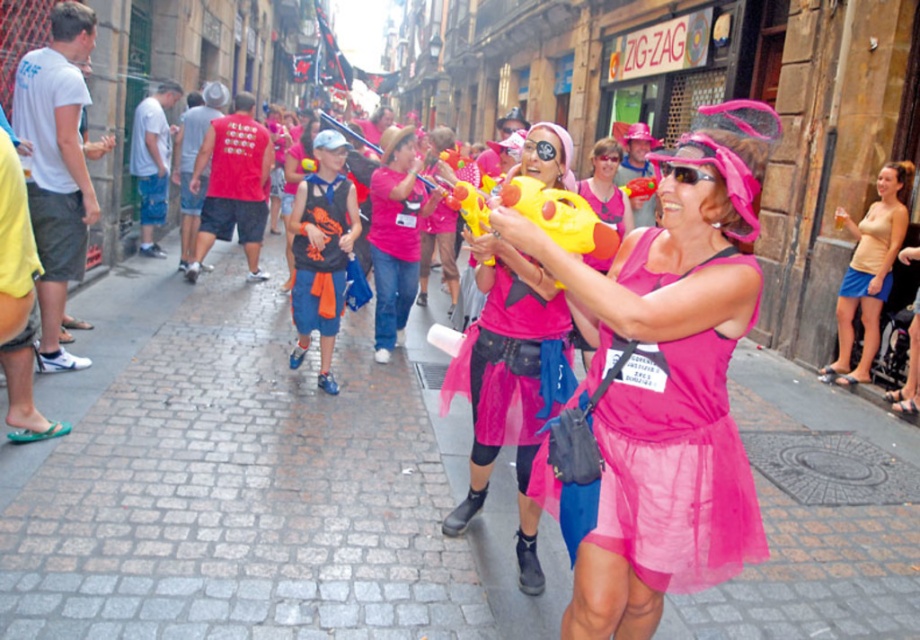
Question: Which object appears closest to the camera in this image?

Choices:
 (A) beige cotton tank top at right
 (B) pink fabric toy gun at center
 (C) matte pink tulle dress at center

Answer: (C)

Question: Based on their relative distances, which object is farther from the matte pink tulle skirt at center?

Choices:
 (A) beige cotton tank top at right
 (B) matte pink tulle dress at center

Answer: (A)

Question: Does matte pink tulle skirt at center have a greater width compared to pink fabric toy gun at center?

Choices:
 (A) no
 (B) yes

Answer: (A)

Question: Among these points, which one is farthest from the camera?

Choices:
 (A) (716, 384)
 (B) (726, 140)
 (C) (415, 188)

Answer: (C)

Question: Can you confirm if matte pink tulle dress at center is bigger than matte pink tulle skirt at center?

Choices:
 (A) no
 (B) yes

Answer: (A)

Question: Is matte pink tulle dress at center thinner than pink fabric toy gun at center?

Choices:
 (A) yes
 (B) no

Answer: (A)